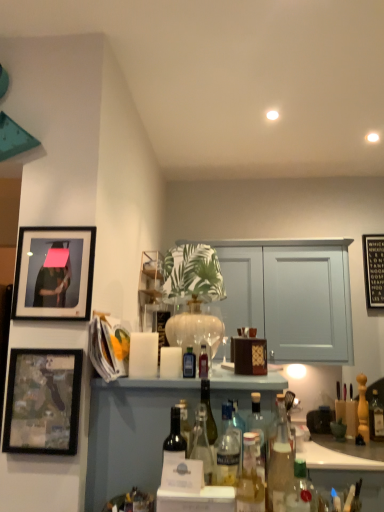
You are a GUI agent. You are given a task and a screenshot of the screen. Output one action in this format:
    pyautogui.click(x=<x>, y=<y>)
    Task: Click on the clear glass bottle at center, the 5th bottle positioned from the back
    The width and height of the screenshot is (384, 512).
    Given the screenshot: What is the action you would take?
    pyautogui.click(x=258, y=424)

The width and height of the screenshot is (384, 512). Describe the element at coordinates (54, 273) in the screenshot. I see `matte black picture frame at upper left, the second picture frame viewed from the right` at that location.

What do you see at coordinates (300, 490) in the screenshot?
I see `translucent glass bottle at lower right, the 8th bottle in the left-to-right sequence` at bounding box center [300, 490].

How much space does translucent glass bottle at lower right, the first bottle positioned from the back, occupy horizontally?

translucent glass bottle at lower right, the first bottle positioned from the back, is 4.18 inches wide.

What do you see at coordinates (373, 270) in the screenshot?
I see `black matte picture frame at right, the first picture frame from the back` at bounding box center [373, 270].

What do you see at coordinates (250, 479) in the screenshot? I see `translucent glass bottle at center, which appears as the 9th bottle when viewed from the back` at bounding box center [250, 479].

What are the coordinates of `clear glass bottle at center, the sixth bottle in the left-to-right sequence` in the screenshot? It's located at (258, 424).

Which of these two, clear glass bottle at center, positioned as the fourth bottle in back-to-front order, or translucent glass bottles at center, is wider?

translucent glass bottles at center.

Is clear glass bottle at center, which ranks as the sixth bottle in front-to-back order, in front of or behind translucent glass bottles at center in the image?

Clearly, clear glass bottle at center, which ranks as the sixth bottle in front-to-back order, is in front of translucent glass bottles at center.

Considering the relative sizes of clear glass bottle at center, positioned as the 7th bottle in left-to-right order, and translucent glass bottles at center in the image provided, is clear glass bottle at center, positioned as the 7th bottle in left-to-right order, bigger than translucent glass bottles at center?

Actually, clear glass bottle at center, positioned as the 7th bottle in left-to-right order, might be smaller than translucent glass bottles at center.

Which is in front, point (280, 438) or point (153, 380)?

The point (280, 438) is closer.

What's the angular difference between clear glass bottle at center, the sixth bottle in the left-to-right sequence, and black matte picture frame at right, the first picture frame viewed from the right,'s facing directions?

clear glass bottle at center, the sixth bottle in the left-to-right sequence, and black matte picture frame at right, the first picture frame viewed from the right, are facing 90 degrees away from each other.

Considering the sizes of objects clear glass bottle at center, the sixth bottle in the left-to-right sequence, and black matte picture frame at right, the first picture frame viewed from the right, in the image provided, who is taller, clear glass bottle at center, the sixth bottle in the left-to-right sequence, or black matte picture frame at right, the first picture frame viewed from the right,?

Standing taller between the two is black matte picture frame at right, the first picture frame viewed from the right.

Considering the relative sizes of clear glass bottle at center, the fourth bottle viewed from the right, and black matte picture frame at right, which ranks as the 3th picture frame in front-to-back order, in the image provided, is clear glass bottle at center, the fourth bottle viewed from the right, wider than black matte picture frame at right, which ranks as the 3th picture frame in front-to-back order,?

Yes, clear glass bottle at center, the fourth bottle viewed from the right, is wider than black matte picture frame at right, which ranks as the 3th picture frame in front-to-back order.

Which is more distant, (253, 409) or (372, 260)?

Point (372, 260)

Is translucent glass bottle at lower right, which is the 2th bottle in front-to-back order, facing towards dark glass bottle at center, acting as the second bottle starting from the back?

No, translucent glass bottle at lower right, which is the 2th bottle in front-to-back order, does not turn towards dark glass bottle at center, acting as the second bottle starting from the back.

Considering the points (306, 485) and (190, 365), which point is in front, point (306, 485) or point (190, 365)?

The point (306, 485) is closer.

How much distance is there between translucent glass bottle at lower right, the 8th bottle viewed from the back, and dark glass bottle at center, the 8th bottle from the right?

translucent glass bottle at lower right, the 8th bottle viewed from the back, and dark glass bottle at center, the 8th bottle from the right, are 20.07 inches apart.

Based on their sizes in the image, would you say translucent glass bottle at lower right, which is the 2th bottle in front-to-back order, is bigger or smaller than dark glass bottle at center, which appears as the eighth bottle when viewed from the front?

Clearly, translucent glass bottle at lower right, which is the 2th bottle in front-to-back order, is larger in size than dark glass bottle at center, which appears as the eighth bottle when viewed from the front.

In the scene shown: Does black matte picture frame at right, the 3th picture frame when ordered from left to right, have a greater width compared to translucent glass bottles at center?

No, black matte picture frame at right, the 3th picture frame when ordered from left to right, is not wider than translucent glass bottles at center.

Where is `cabinetry on the left of the black matte picture frame at right, the first picture frame viewed from the right`? Image resolution: width=384 pixels, height=512 pixels. cabinetry on the left of the black matte picture frame at right, the first picture frame viewed from the right is located at coordinates (130, 433).

Is point (380, 302) more distant than point (193, 396)?

Yes, it is.

Considering the positions of objects translucent glass bottle at lower right, the first bottle positioned from the back, and translucent glass bottle at center, which is the sixth bottle in back-to-front order, in the image provided, who is more to the right, translucent glass bottle at lower right, the first bottle positioned from the back, or translucent glass bottle at center, which is the sixth bottle in back-to-front order,?

translucent glass bottle at lower right, the first bottle positioned from the back, is more to the right.

Is translucent glass bottle at center, the 3th bottle in the left-to-right sequence, completely or partially inside translucent glass bottle at lower right, acting as the first bottle starting from the right?

That's incorrect, translucent glass bottle at center, the 3th bottle in the left-to-right sequence, is not inside translucent glass bottle at lower right, acting as the first bottle starting from the right.

Does point (383, 419) come behind point (193, 447)?

Yes, it is behind point (193, 447).

From the image's perspective, is wooden framed picture at lower left, the first picture frame when ordered from left to right, positioned above or below wooden at upper center?

Clearly, from the image's perspective, wooden framed picture at lower left, the first picture frame when ordered from left to right, is below wooden at upper center.

Find the location of a particular element. This screenshot has width=384, height=512. shelf that appears on the right of wooden framed picture at lower left, acting as the 3th picture frame starting from the right is located at coordinates (149, 284).

Can you tell me how much wooden framed picture at lower left, the first picture frame when ordered from left to right, and wooden at upper center differ in facing direction?

They differ by 90 degrees in their facing directions.

Which is more to the left, wooden framed picture at lower left, acting as the 3th picture frame starting from the right, or wooden at upper center?

From the viewer's perspective, wooden framed picture at lower left, acting as the 3th picture frame starting from the right, appears more on the left side.

From a real-world perspective, which object rests below the other?

From a 3D spatial view, clear glass bottle at center, the sixth bottle in the left-to-right sequence, is below.

Which of these two, dark glass bottle at center, which appears as the eighth bottle when viewed from the front, or clear glass bottle at center, the sixth bottle in the left-to-right sequence, stands taller?

Standing taller between the two is clear glass bottle at center, the sixth bottle in the left-to-right sequence.

Does dark glass bottle at center, the 8th bottle from the right, turn towards clear glass bottle at center, the sixth bottle in the left-to-right sequence?

No, dark glass bottle at center, the 8th bottle from the right, is not aimed at clear glass bottle at center, the sixth bottle in the left-to-right sequence.

Where is `cabinetry located on the left of clear glass bottle at center, positioned as the fourth bottle in back-to-front order`? The width and height of the screenshot is (384, 512). cabinetry located on the left of clear glass bottle at center, positioned as the fourth bottle in back-to-front order is located at coordinates (130, 433).

I want to click on picture frame that is the 3rd object located behind the clear glass bottle at center, the 5th bottle when ordered from front to back, so click(373, 270).

When comparing their distances from translucent glass bottle at center, which appears as the 7th bottle when viewed from the front, does translucent glass bottle at lower right, the 8th bottle in the left-to-right sequence, or dark glass bottle at center, acting as the second bottle starting from the back, seem closer?

Based on the image, dark glass bottle at center, acting as the second bottle starting from the back, appears to be nearer to translucent glass bottle at center, which appears as the 7th bottle when viewed from the front.

Which object lies further to the anchor point wooden framed picture at lower left, acting as the 3th picture frame starting from the right, wooden at upper center or clear glass bottle at center, the 5th bottle positioned from the back?

The object further to wooden framed picture at lower left, acting as the 3th picture frame starting from the right, is wooden at upper center.

Considering their positions, is translucent glass bottle at center, the 3th bottle in the left-to-right sequence, positioned further to dark glass bottle at center, placed as the second bottle when sorted from left to right, than translucent glass bottle at center, the 5th bottle viewed from the left?

The object further to dark glass bottle at center, placed as the second bottle when sorted from left to right, is translucent glass bottle at center, the 5th bottle viewed from the left.

Considering their positions, is wooden at upper center positioned further to translucent glass bottle at center, the 5th bottle viewed from the left, than translucent glass bottle at center, which is the 4th bottle from left to right?

Based on the image, wooden at upper center appears to be further to translucent glass bottle at center, the 5th bottle viewed from the left.

Based on their spatial positions, is translucent glass bottle at lower right, the 8th bottle viewed from the back, or black matte picture frame at right, the 3th picture frame when ordered from left to right, closer to dark glass bottle at center, marked as the 1th bottle in a left-to-right arrangement?

The object closer to dark glass bottle at center, marked as the 1th bottle in a left-to-right arrangement, is translucent glass bottle at lower right, the 8th bottle viewed from the back.

Based on the photo, from the image, which object appears to be farther from dark glass bottle at center, the 8th bottle from the right, translucent glass bottle at lower right, which is the 2th bottle from right to left, or wooden framed picture at lower left, the 3th picture frame from the back?

translucent glass bottle at lower right, which is the 2th bottle from right to left, is positioned further to the anchor dark glass bottle at center, the 8th bottle from the right.

Based on their spatial positions, is translucent glass bottle at lower right, which is the ninth bottle from left to right, or clear glass bottle at center, the sixth bottle in the left-to-right sequence, further from translucent glass bottle at lower right, the 8th bottle in the left-to-right sequence?

Among the two, translucent glass bottle at lower right, which is the ninth bottle from left to right, is located further to translucent glass bottle at lower right, the 8th bottle in the left-to-right sequence.

When comparing their distances from translucent glass bottle at center, the sixth bottle positioned from the right, does translucent glass bottle at lower right, which is the 2th bottle from right to left, or translucent glass bottle at lower right, the first bottle positioned from the back, seem further?

The object further to translucent glass bottle at center, the sixth bottle positioned from the right, is translucent glass bottle at lower right, the first bottle positioned from the back.

At what (x,y) coordinates should I click in order to perform the action: click on bottle between dark glass bottle at center, acting as the second bottle starting from the back, and black matte picture frame at right, the first picture frame viewed from the right, along the z-axis. Please return your answer as a coordinate pair (x, y). Image resolution: width=384 pixels, height=512 pixels. Looking at the image, I should click on (376, 418).

Where is `cabinetry between translucent glass bottle at center, the 5th bottle viewed from the left, and black matte picture frame at right, the first picture frame viewed from the right, along the z-axis`? cabinetry between translucent glass bottle at center, the 5th bottle viewed from the left, and black matte picture frame at right, the first picture frame viewed from the right, along the z-axis is located at coordinates (130, 433).

Where is `cabinetry situated between wooden at upper center and black matte picture frame at right, the 3th picture frame when ordered from left to right, from left to right`? The width and height of the screenshot is (384, 512). cabinetry situated between wooden at upper center and black matte picture frame at right, the 3th picture frame when ordered from left to right, from left to right is located at coordinates (130, 433).

Where is `picture frame between wooden framed picture at lower left, the first picture frame when ordered from left to right, and clear glass bottle at center, the 5th bottle positioned from the back, in the horizontal direction`? This screenshot has width=384, height=512. picture frame between wooden framed picture at lower left, the first picture frame when ordered from left to right, and clear glass bottle at center, the 5th bottle positioned from the back, in the horizontal direction is located at coordinates (54, 273).